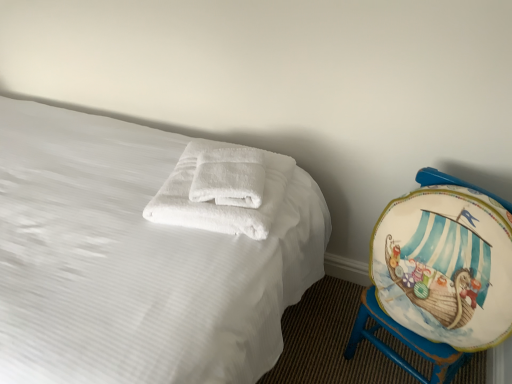
Question: Does white soft towel at center have a lesser width compared to white fluffy towels at center?

Choices:
 (A) no
 (B) yes

Answer: (A)

Question: From the image's perspective, would you say white soft towel at center is shown under white fluffy towels at center?

Choices:
 (A) yes
 (B) no

Answer: (A)

Question: Considering the relative positions of white soft towel at center and white fluffy towels at center in the image provided, is white soft towel at center to the right of white fluffy towels at center from the viewer's perspective?

Choices:
 (A) no
 (B) yes

Answer: (A)

Question: Is white soft towel at center bigger than white fluffy towels at center?

Choices:
 (A) yes
 (B) no

Answer: (A)

Question: From a real-world perspective, is white soft towel at center over white fluffy towels at center?

Choices:
 (A) yes
 (B) no

Answer: (B)

Question: Is the depth of white soft towel at center less than that of white fluffy towels at center?

Choices:
 (A) no
 (B) yes

Answer: (B)

Question: From the image's perspective, does white fluffy towels at center appear higher than white soft towel at center?

Choices:
 (A) yes
 (B) no

Answer: (A)

Question: Is white fluffy towels at center further to camera compared to white soft towel at center?

Choices:
 (A) yes
 (B) no

Answer: (A)

Question: Is white fluffy towels at center at the right side of white soft towel at center?

Choices:
 (A) yes
 (B) no

Answer: (A)

Question: Can we say white fluffy towels at center lies outside white soft towel at center?

Choices:
 (A) yes
 (B) no

Answer: (B)

Question: Can you confirm if white fluffy towels at center is bigger than white soft towel at center?

Choices:
 (A) no
 (B) yes

Answer: (A)

Question: Is white fluffy towels at center far away from white soft towel at center?

Choices:
 (A) yes
 (B) no

Answer: (B)

Question: Could you tell me if white fluffy towels at center is facing painted wood globe at right?

Choices:
 (A) yes
 (B) no

Answer: (A)